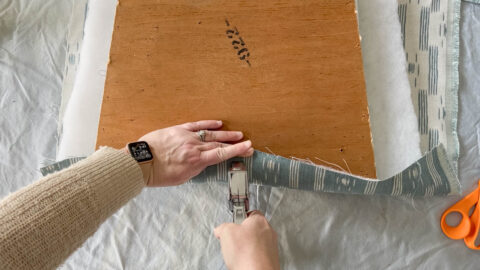
Where is `orange scissors handle`? orange scissors handle is located at coordinates (463, 226).